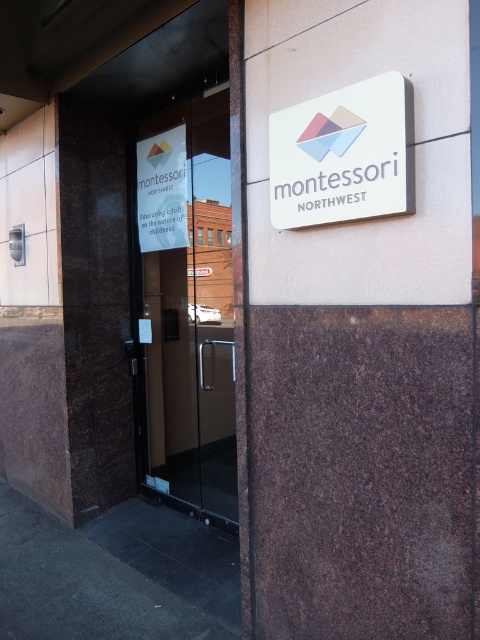
Is transparent glass door at center positioned behind white plastic sign at upper center?

That is True.

Is transparent glass door at center closer to camera compared to white plastic sign at upper center?

No, it is behind white plastic sign at upper center.

Between point (200, 508) and point (349, 204), which one is positioned in front?

Point (349, 204)

This screenshot has width=480, height=640. What are the coordinates of `transparent glass door at center` in the screenshot? It's located at (188, 304).

Which of these two, white plastic sign at upper center or white paper sign at left, stands shorter?

Standing shorter between the two is white plastic sign at upper center.

Which is more to the left, white plastic sign at upper center or white paper sign at left?

Positioned to the left is white paper sign at left.

Between point (381, 156) and point (137, 225), which one is positioned behind?

Point (137, 225)

Locate an element on the screen. This screenshot has width=480, height=640. white plastic sign at upper center is located at coordinates (344, 154).

Is point (228, 518) positioned in front of point (172, 186)?

Yes, it is.

Can you confirm if transparent glass door at center is positioned below white paper sign at left?

Yes.

Image resolution: width=480 pixels, height=640 pixels. I want to click on transparent glass door at center, so click(x=188, y=304).